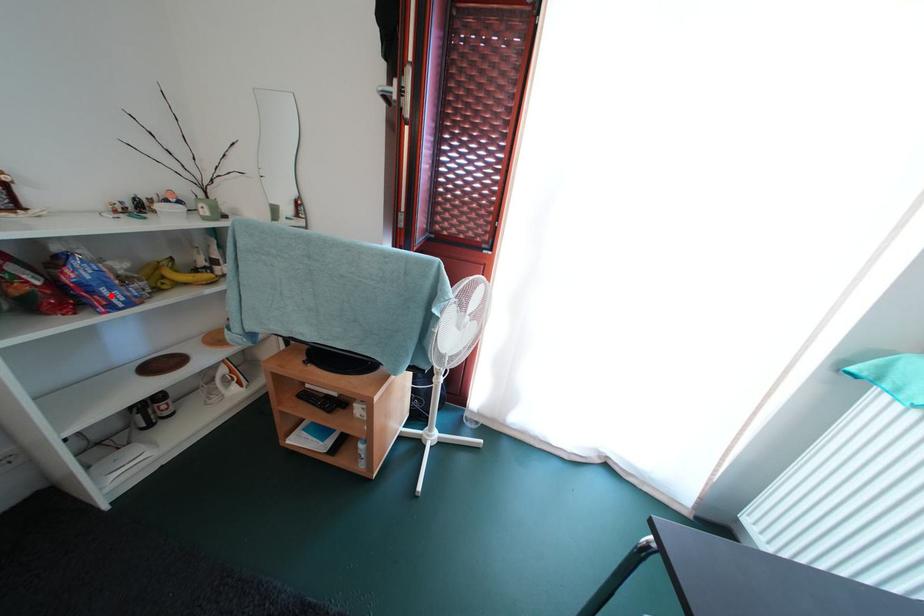
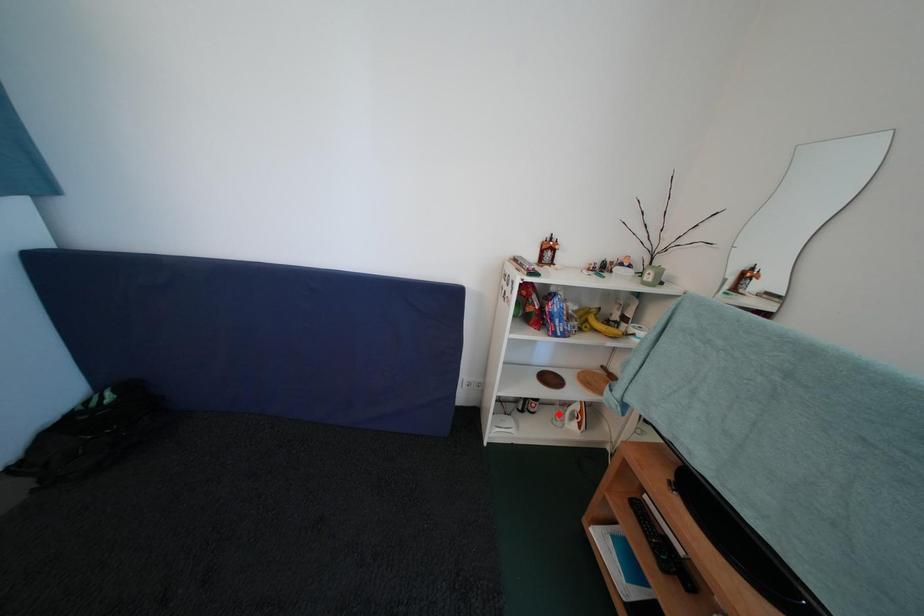
I am providing you with two images of the same scene from different viewpoints. A red point is marked on the first image and another point is marked on the second image. Do the highlighted points in image1 and image2 indicate the same real-world spot?

No